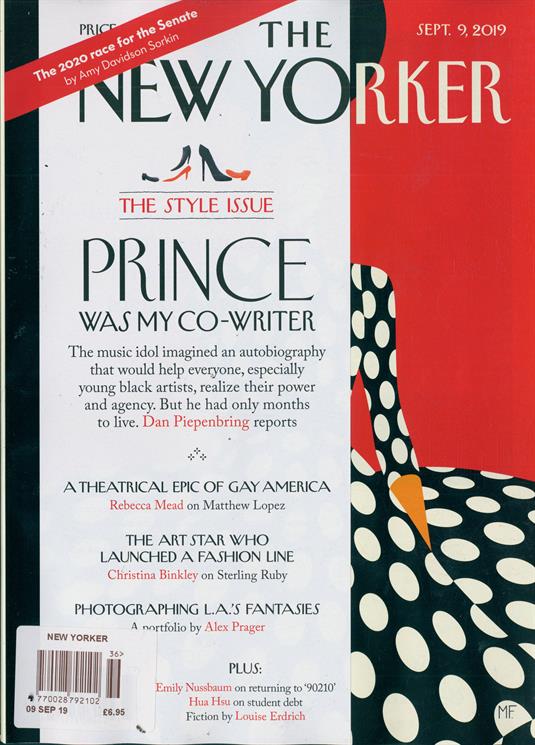
This screenshot has width=535, height=745. I want to click on book, so click(x=289, y=437).